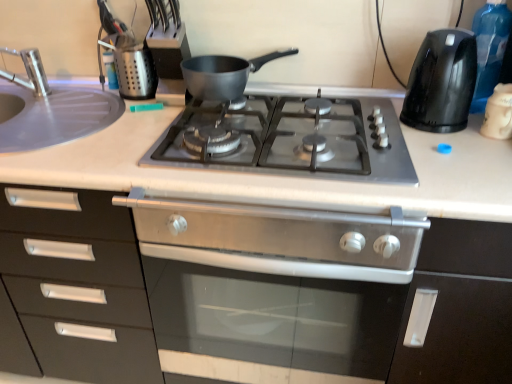
Question: Considering the relative positions of metallic silver utensil holder at upper left and white glossy coffee cup at upper right, which is counted as the 1th kitchen appliance, starting from the right, in the image provided, is metallic silver utensil holder at upper left behind white glossy coffee cup at upper right, which is counted as the 1th kitchen appliance, starting from the right,?

Choices:
 (A) no
 (B) yes

Answer: (B)

Question: Is the surface of metallic silver utensil holder at upper left in direct contact with white glossy coffee cup at upper right, which is counted as the 1th kitchen appliance, starting from the right?

Choices:
 (A) yes
 (B) no

Answer: (B)

Question: Is metallic silver utensil holder at upper left smaller than white glossy coffee cup at upper right, the third kitchen appliance viewed from the left?

Choices:
 (A) yes
 (B) no

Answer: (A)

Question: Does metallic silver utensil holder at upper left have a greater width compared to white glossy coffee cup at upper right, the third kitchen appliance viewed from the left?

Choices:
 (A) yes
 (B) no

Answer: (B)

Question: Does metallic silver utensil holder at upper left appear on the left side of white glossy coffee cup at upper right, which is counted as the 1th kitchen appliance, starting from the right?

Choices:
 (A) no
 (B) yes

Answer: (B)

Question: Can you confirm if metallic silver utensil holder at upper left is bigger than white glossy coffee cup at upper right, the third kitchen appliance viewed from the left?

Choices:
 (A) no
 (B) yes

Answer: (A)

Question: Does metallic silver utensil holder at upper left contain silver metallic faucet at left?

Choices:
 (A) no
 (B) yes

Answer: (A)

Question: From a real-world perspective, is metallic silver utensil holder at upper left physically below silver metallic faucet at left?

Choices:
 (A) no
 (B) yes

Answer: (B)

Question: Is metallic silver utensil holder at upper left closer to the viewer compared to silver metallic faucet at left?

Choices:
 (A) yes
 (B) no

Answer: (B)

Question: Is metallic silver utensil holder at upper left located outside silver metallic faucet at left?

Choices:
 (A) no
 (B) yes

Answer: (B)

Question: From a real-world perspective, is metallic silver utensil holder at upper left positioned over silver metallic faucet at left based on gravity?

Choices:
 (A) no
 (B) yes

Answer: (A)

Question: From the image's perspective, is metallic silver utensil holder at upper left under silver metallic faucet at left?

Choices:
 (A) yes
 (B) no

Answer: (A)

Question: Can you confirm if metallic silver utensil holder at upper left is wider than transparent plastic bottle at right?

Choices:
 (A) yes
 (B) no

Answer: (B)